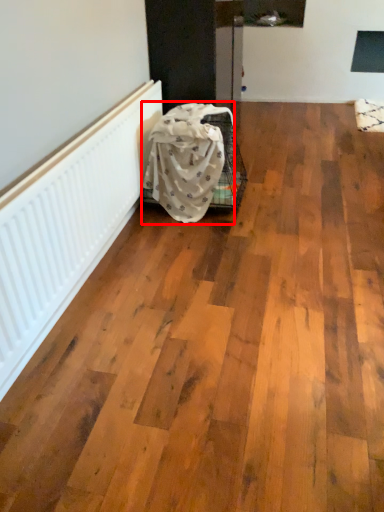
Question: From the image's perspective, where is blanket (annotated by the red box) located relative to radiator?

Choices:
 (A) below
 (B) above

Answer: (B)